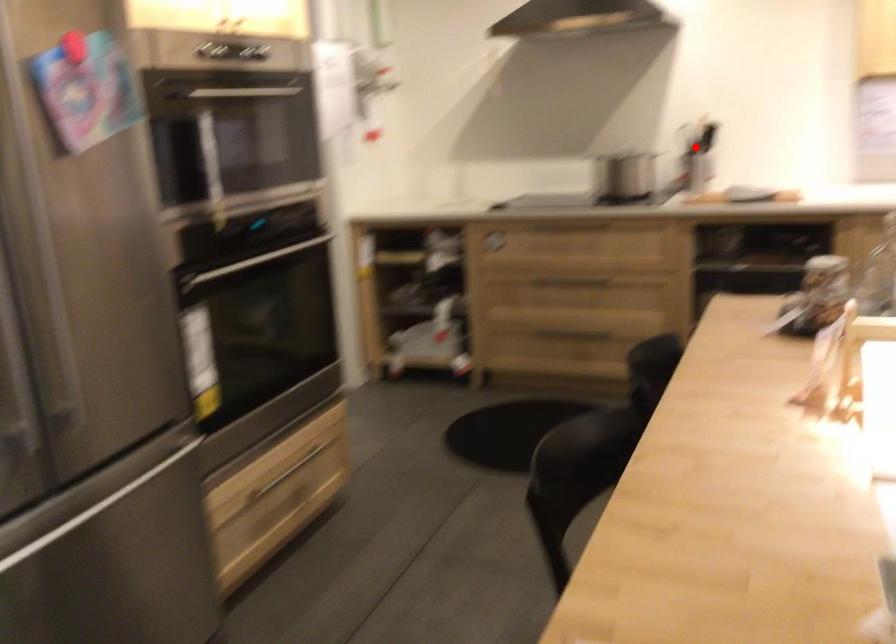
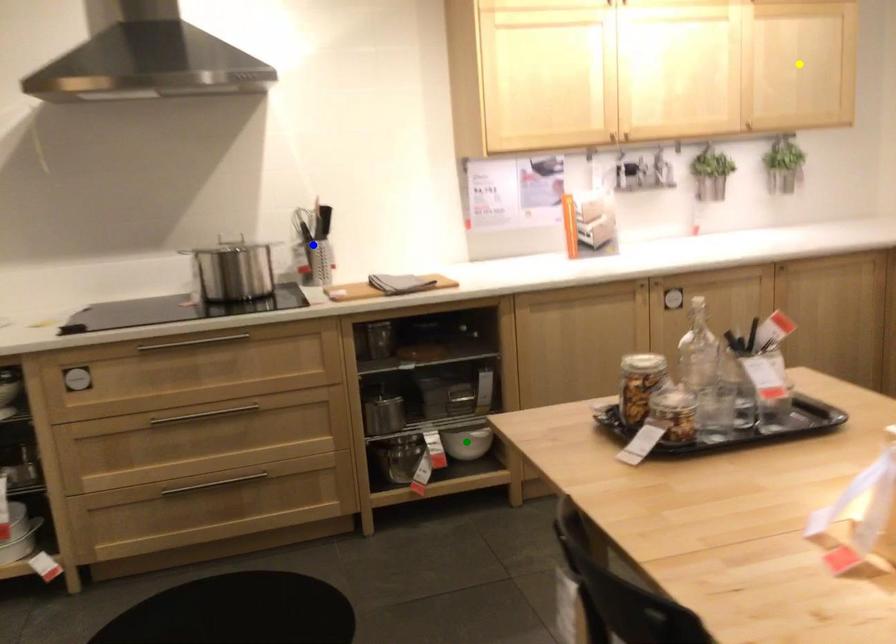
Question: I am providing you with two images of the same scene from different viewpoints. A red point is marked on the first image. You are given multiple points on the second image. Which mark in image 2 goes with the point in image 1?

Choices:
 (A) green point
 (B) blue point
 (C) yellow point

Answer: (B)